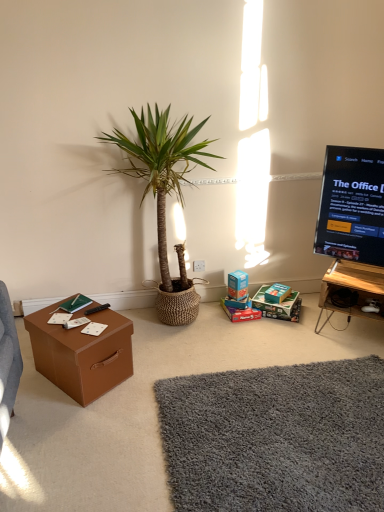
Locate an element on the screen. Image resolution: width=384 pixels, height=512 pixels. free point above teal cardboard box at center, marked as the 2th storage box in a right-to-left arrangement (from a real-world perspective) is located at coordinates [271, 295].